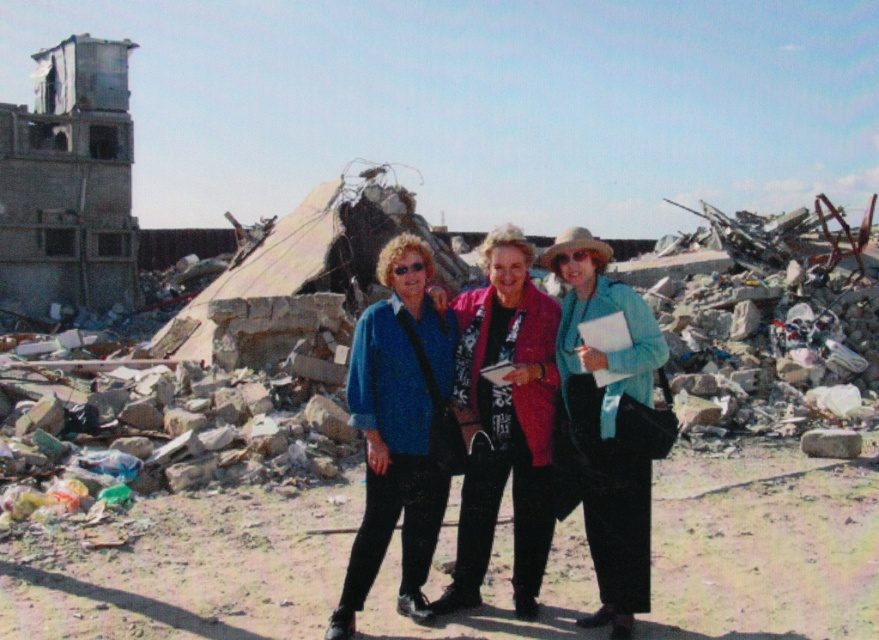
You are a photographer positioned at the origin point of the image. You need to capture a closeup shot of the blue fabric jacket at center. Which direction should you move your camera to focus on it?

The blue fabric jacket at center is located at point (549, 429), so you should move your camera to the right and upwards to focus on it.